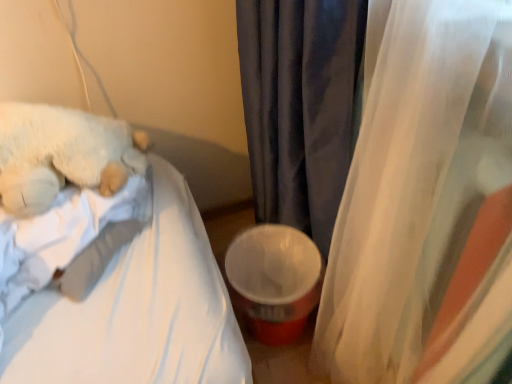
Question: Can you confirm if velvet dark gray curtain at center, acting as the 1th curtain starting from the left, is positioned to the right of translucent fabric curtain at right, which ranks as the first curtain in right-to-left order?

Choices:
 (A) no
 (B) yes

Answer: (A)

Question: Can you confirm if velvet dark gray curtain at center, acting as the second curtain starting from the right, is shorter than translucent fabric curtain at right, which ranks as the first curtain in right-to-left order?

Choices:
 (A) no
 (B) yes

Answer: (A)

Question: Considering the relative sizes of velvet dark gray curtain at center, acting as the 1th curtain starting from the left, and translucent fabric curtain at right, the 2th curtain from the left, in the image provided, is velvet dark gray curtain at center, acting as the 1th curtain starting from the left, taller than translucent fabric curtain at right, the 2th curtain from the left,?

Choices:
 (A) no
 (B) yes

Answer: (B)

Question: Is velvet dark gray curtain at center, acting as the second curtain starting from the right, outside of translucent fabric curtain at right, the 2th curtain from the left?

Choices:
 (A) yes
 (B) no

Answer: (A)

Question: Considering the relative sizes of velvet dark gray curtain at center, acting as the second curtain starting from the right, and translucent fabric curtain at right, which ranks as the first curtain in right-to-left order, in the image provided, is velvet dark gray curtain at center, acting as the second curtain starting from the right, bigger than translucent fabric curtain at right, which ranks as the first curtain in right-to-left order,?

Choices:
 (A) no
 (B) yes

Answer: (A)

Question: From the image's perspective, is white soft fabric mattress at upper left positioned above or below velvet dark gray curtain at center, acting as the second curtain starting from the right?

Choices:
 (A) below
 (B) above

Answer: (A)

Question: From a real-world perspective, is white soft fabric mattress at upper left physically located above or below velvet dark gray curtain at center, acting as the 1th curtain starting from the left?

Choices:
 (A) below
 (B) above

Answer: (A)

Question: Is white soft fabric mattress at upper left bigger or smaller than velvet dark gray curtain at center, acting as the 1th curtain starting from the left?

Choices:
 (A) small
 (B) big

Answer: (B)

Question: Relative to velvet dark gray curtain at center, acting as the second curtain starting from the right, is white soft fabric mattress at upper left in front or behind?

Choices:
 (A) front
 (B) behind

Answer: (A)

Question: Is white fluffy teddy bear at left wider or thinner than velvet dark gray curtain at center, acting as the 1th curtain starting from the left?

Choices:
 (A) thin
 (B) wide

Answer: (B)

Question: Relative to velvet dark gray curtain at center, acting as the second curtain starting from the right, is white fluffy teddy bear at left in front or behind?

Choices:
 (A) front
 (B) behind

Answer: (B)

Question: Considering the positions of white fluffy teddy bear at left and velvet dark gray curtain at center, acting as the second curtain starting from the right, in the image, is white fluffy teddy bear at left taller or shorter than velvet dark gray curtain at center, acting as the second curtain starting from the right,?

Choices:
 (A) tall
 (B) short

Answer: (B)

Question: In terms of size, does white fluffy teddy bear at left appear bigger or smaller than velvet dark gray curtain at center, acting as the second curtain starting from the right?

Choices:
 (A) big
 (B) small

Answer: (A)

Question: From a real-world perspective, is translucent fabric curtain at right, which ranks as the first curtain in right-to-left order, above or below velvet dark gray curtain at center, acting as the second curtain starting from the right?

Choices:
 (A) above
 (B) below

Answer: (A)

Question: From their relative heights in the image, would you say translucent fabric curtain at right, the 2th curtain from the left, is taller or shorter than velvet dark gray curtain at center, acting as the 1th curtain starting from the left?

Choices:
 (A) short
 (B) tall

Answer: (A)